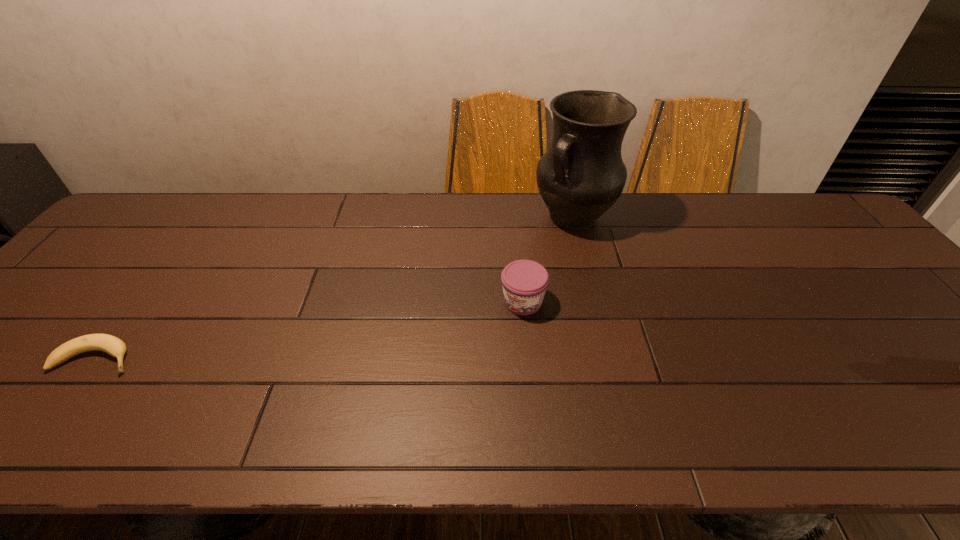
In the image, there is a desktop. Find the location of `free region at the right edge`. free region at the right edge is located at coordinates (880, 278).

This screenshot has height=540, width=960. What are the coordinates of `free space at the far right corner of the desktop` in the screenshot? It's located at (809, 213).

Locate an element on the screen. empty space that is in between the second farthest object and the banana is located at coordinates (309, 330).

Find the location of a particular element. vacant area that lies between the shortest object and the farthest object is located at coordinates (335, 288).

I want to click on vacant area that lies between the farthest object and the shortest object, so click(335, 288).

Locate an element on the screen. This screenshot has height=540, width=960. empty space that is in between the jam and the tallest object is located at coordinates (548, 259).

At what (x,y) coordinates should I click in order to perform the action: click on vacant point located between the pitcher and the shortest object. Please return your answer as a coordinate pair (x, y). Looking at the image, I should click on (335, 288).

Locate an element on the screen. The height and width of the screenshot is (540, 960). object that is the closest to the jam is located at coordinates (582, 174).

Locate which object is the closest to the tallest object. Please provide its 2D coordinates. Your answer should be formatted as a tuple, i.e. [(x, y)], where the tuple contains the x and y coordinates of a point satisfying the conditions above.

[(524, 282)]

The image size is (960, 540). I want to click on blank area in the image that satisfies the following two spatial constraints: 1. on the back side of the second tallest object; 2. on the left side of the tallest object, so click(x=515, y=217).